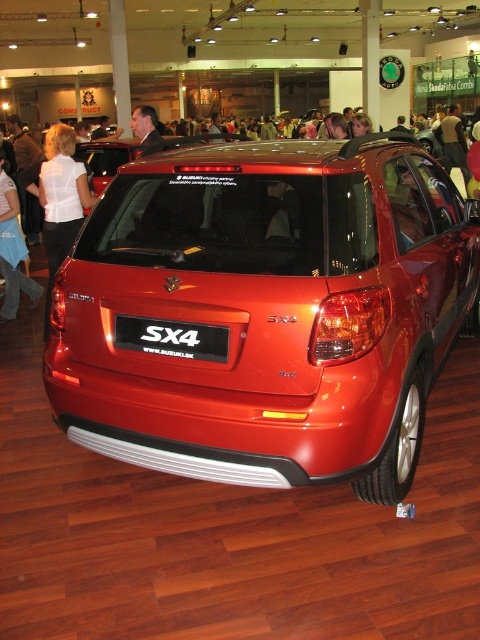
Question: Which object is closer to the camera taking this photo?

Choices:
 (A) matte black jacket at upper center
 (B) glossy metallic suv at center
 (C) white fabric shirt at upper left
 (D) white fabric shirt at left

Answer: (B)

Question: Does glossy metallic suv at center appear over white plastic license plate at center?

Choices:
 (A) yes
 (B) no

Answer: (A)

Question: Which object is positioned closest to the dark suit jacket at upper center?

Choices:
 (A) white fabric shirt at upper left
 (B) white fabric shirt at left

Answer: (B)

Question: Is matte black jacket at upper center bigger than dark suit jacket at upper center?

Choices:
 (A) yes
 (B) no

Answer: (B)

Question: Which point is closer to the camera taking this photo?

Choices:
 (A) (274, 300)
 (B) (62, 234)
 (C) (455, 116)
 (D) (203, 340)

Answer: (A)

Question: Does white fabric shirt at left have a lesser width compared to dark suit jacket at upper center?

Choices:
 (A) yes
 (B) no

Answer: (A)